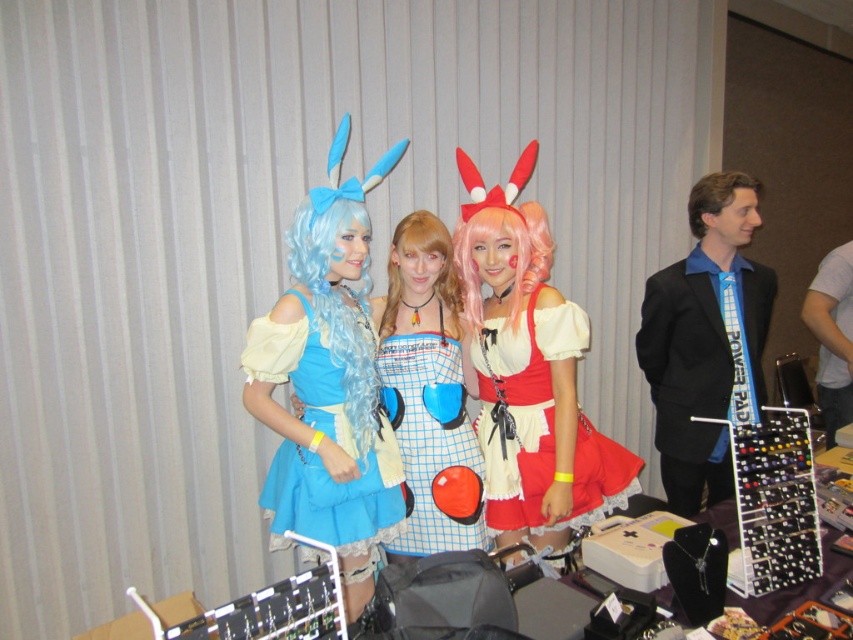
Can you confirm if red satin dress at center is bigger than blue silky wig at center?

Yes, red satin dress at center is bigger than blue silky wig at center.

Does red satin dress at center have a lesser width compared to blue silky wig at center?

Incorrect, red satin dress at center's width is not less than blue silky wig at center's.

Identify the location of red satin dress at center. (519, 417).

You are a GUI agent. You are given a task and a screenshot of the screen. Output one action in this format:
    pyautogui.click(x=<x>, y=<y>)
    Task: Click on the red satin dress at center
    This screenshot has width=853, height=640.
    Given the screenshot: What is the action you would take?
    pyautogui.click(x=519, y=417)

Who is positioned more to the left, black suit at right or blue silky wig at center?

Positioned to the left is blue silky wig at center.

Identify the location of black suit at right. (703, 339).

Is blue silky wig at center to the right of white fabric shirt at right from the viewer's perspective?

Incorrect, blue silky wig at center is not on the right side of white fabric shirt at right.

Is blue silky wig at center taller than white fabric shirt at right?

Incorrect, blue silky wig at center's height is not larger of white fabric shirt at right's.

Describe the element at coordinates (338, 307) in the screenshot. This screenshot has height=640, width=853. I see `blue silky wig at center` at that location.

Where is `blue silky wig at center`? The width and height of the screenshot is (853, 640). blue silky wig at center is located at coordinates (338, 307).